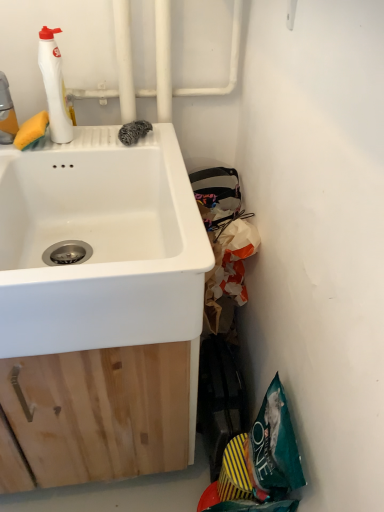
In order to face white matte bottle at upper left, which is the first cleaning product in right-to-left order, should I rotate leftwards or rightwards?

Turn left by 17.891 degrees to look at white matte bottle at upper left, which is the first cleaning product in right-to-left order.

Describe the element at coordinates (260, 462) in the screenshot. I see `teal fabric bag at lower right` at that location.

Find the location of `white ceramic sink at upper left`. white ceramic sink at upper left is located at coordinates (100, 244).

The image size is (384, 512). Find the location of `white matte bottle at upper left, which is the first cleaning product in right-to-left order`. white matte bottle at upper left, which is the first cleaning product in right-to-left order is located at coordinates (54, 86).

Based on the photo, considering the sizes of objects white ceramic sink at upper left and teal fabric bag at lower right in the image provided, who is smaller, white ceramic sink at upper left or teal fabric bag at lower right?

Smaller between the two is teal fabric bag at lower right.

Could teal fabric bag at lower right be considered to be inside white ceramic sink at upper left?

Definitely not — teal fabric bag at lower right is not inside white ceramic sink at upper left.

From the image's perspective, would you say white ceramic sink at upper left is shown under teal fabric bag at lower right?

No, from the image's perspective, white ceramic sink at upper left is not beneath teal fabric bag at lower right.

Does translucent white bottle at upper left, which is the 1th cleaning product from left to right, have a lesser width compared to teal fabric bag at lower right?

No, translucent white bottle at upper left, which is the 1th cleaning product from left to right, is not thinner than teal fabric bag at lower right.

Is translucent white bottle at upper left, which is the 1th cleaning product from left to right, oriented away from teal fabric bag at lower right?

No, translucent white bottle at upper left, which is the 1th cleaning product from left to right,'s orientation is not away from teal fabric bag at lower right.

Based on the photo, does translucent white bottle at upper left, which is the 1th cleaning product from left to right, lie in front of teal fabric bag at lower right?

Yes, translucent white bottle at upper left, which is the 1th cleaning product from left to right, is closer to the camera.

Who is shorter, teal fabric bag at lower right or translucent white bottle at upper left, which is the 1th cleaning product from left to right?

With less height is translucent white bottle at upper left, which is the 1th cleaning product from left to right.

Considering the relative positions of teal fabric bag at lower right and translucent white bottle at upper left, which ranks as the 2th cleaning product in right-to-left order, in the image provided, is teal fabric bag at lower right to the right of translucent white bottle at upper left, which ranks as the 2th cleaning product in right-to-left order, from the viewer's perspective?

Yes, teal fabric bag at lower right is to the right of translucent white bottle at upper left, which ranks as the 2th cleaning product in right-to-left order.

From a real-world perspective, is teal fabric bag at lower right physically located above or below translucent white bottle at upper left, which is the 1th cleaning product from left to right?

From a real-world perspective, teal fabric bag at lower right is physically below translucent white bottle at upper left, which is the 1th cleaning product from left to right.

From the image's perspective, is translucent white bottle at upper left, which is the 1th cleaning product from left to right, beneath white ceramic sink at upper left?

Actually, translucent white bottle at upper left, which is the 1th cleaning product from left to right, appears above white ceramic sink at upper left in the image.

In terms of width, does translucent white bottle at upper left, which is the 1th cleaning product from left to right, look wider or thinner when compared to white ceramic sink at upper left?

Considering their sizes, translucent white bottle at upper left, which is the 1th cleaning product from left to right, looks slimmer than white ceramic sink at upper left.

Which is nearer, (x=5, y=100) or (x=21, y=234)?

Point (x=5, y=100) appears to be closer to the viewer than point (x=21, y=234).

Which of these two, teal fabric bag at lower right or white ceramic sink at upper left, is smaller?

teal fabric bag at lower right.

At what (x,y) coordinates should I click in order to perform the action: click on garbage that appears behind the white ceramic sink at upper left. Please return your answer as a coordinate pair (x, y). This screenshot has width=384, height=512. Looking at the image, I should click on (260, 462).

Considering the positions of points (279, 400) and (139, 179), is point (279, 400) closer to camera compared to point (139, 179)?

Yes, it is in front of point (139, 179).

From the image's perspective, is teal fabric bag at lower right above white matte bottle at upper left, which is the first cleaning product in right-to-left order?

Incorrect, from the image's perspective, teal fabric bag at lower right is lower than white matte bottle at upper left, which is the first cleaning product in right-to-left order.

Is teal fabric bag at lower right at the left side of white matte bottle at upper left, which is the first cleaning product in right-to-left order?

Incorrect, teal fabric bag at lower right is not on the left side of white matte bottle at upper left, which is the first cleaning product in right-to-left order.

Is teal fabric bag at lower right thinner than white matte bottle at upper left, which ranks as the second cleaning product in left-to-right order?

In fact, teal fabric bag at lower right might be wider than white matte bottle at upper left, which ranks as the second cleaning product in left-to-right order.

Is teal fabric bag at lower right oriented away from white matte bottle at upper left, which is the first cleaning product in right-to-left order?

No, teal fabric bag at lower right's orientation is not away from white matte bottle at upper left, which is the first cleaning product in right-to-left order.

From their relative heights in the image, would you say white ceramic sink at upper left is taller or shorter than white matte bottle at upper left, which is the first cleaning product in right-to-left order?

Considering their sizes, white ceramic sink at upper left has more height than white matte bottle at upper left, which is the first cleaning product in right-to-left order.

From the picture: Does white ceramic sink at upper left touch white matte bottle at upper left, which is the first cleaning product in right-to-left order?

white ceramic sink at upper left is not next to white matte bottle at upper left, which is the first cleaning product in right-to-left order, and they're not touching.

Is white ceramic sink at upper left facing towards white matte bottle at upper left, which is the first cleaning product in right-to-left order?

No, white ceramic sink at upper left is not aimed at white matte bottle at upper left, which is the first cleaning product in right-to-left order.

Does white ceramic sink at upper left come in front of white matte bottle at upper left, which ranks as the second cleaning product in left-to-right order?

Yes, the depth of white ceramic sink at upper left is less than that of white matte bottle at upper left, which ranks as the second cleaning product in left-to-right order.

This screenshot has height=512, width=384. I want to click on sink in front of the teal fabric bag at lower right, so click(100, 244).

Locate an element on the screen. garbage on the right of the translucent white bottle at upper left, which is the 1th cleaning product from left to right is located at coordinates (260, 462).

When comparing their distances from white matte bottle at upper left, which ranks as the second cleaning product in left-to-right order, does teal fabric bag at lower right or translucent white bottle at upper left, which is the 1th cleaning product from left to right, seem further?

teal fabric bag at lower right is positioned further to the anchor white matte bottle at upper left, which ranks as the second cleaning product in left-to-right order.

Looking at the image, which one is located closer to translucent white bottle at upper left, which ranks as the 2th cleaning product in right-to-left order, teal fabric bag at lower right or white matte bottle at upper left, which is the first cleaning product in right-to-left order?

Based on the image, white matte bottle at upper left, which is the first cleaning product in right-to-left order, appears to be nearer to translucent white bottle at upper left, which ranks as the 2th cleaning product in right-to-left order.

Looking at this image, estimate the real-world distances between objects in this image. Which object is further from translucent white bottle at upper left, which ranks as the 2th cleaning product in right-to-left order, white matte bottle at upper left, which is the first cleaning product in right-to-left order, or white ceramic sink at upper left?

The object further to translucent white bottle at upper left, which ranks as the 2th cleaning product in right-to-left order, is white ceramic sink at upper left.

Which object lies further to the anchor point white matte bottle at upper left, which is the first cleaning product in right-to-left order, translucent white bottle at upper left, which is the 1th cleaning product from left to right, or teal fabric bag at lower right?

teal fabric bag at lower right is positioned further to the anchor white matte bottle at upper left, which is the first cleaning product in right-to-left order.

Estimate the real-world distances between objects in this image. Which object is closer to translucent white bottle at upper left, which ranks as the 2th cleaning product in right-to-left order, white matte bottle at upper left, which is the first cleaning product in right-to-left order, or teal fabric bag at lower right?

The object closer to translucent white bottle at upper left, which ranks as the 2th cleaning product in right-to-left order, is white matte bottle at upper left, which is the first cleaning product in right-to-left order.

Considering their positions, is white ceramic sink at upper left positioned further to white matte bottle at upper left, which ranks as the second cleaning product in left-to-right order, than teal fabric bag at lower right?

teal fabric bag at lower right lies further to white matte bottle at upper left, which ranks as the second cleaning product in left-to-right order, than the other object.

Based on their spatial positions, is teal fabric bag at lower right or translucent white bottle at upper left, which is the 1th cleaning product from left to right, further from white ceramic sink at upper left?

Among the two, teal fabric bag at lower right is located further to white ceramic sink at upper left.

Based on their spatial positions, is translucent white bottle at upper left, which ranks as the 2th cleaning product in right-to-left order, or white matte bottle at upper left, which ranks as the second cleaning product in left-to-right order, further from white ceramic sink at upper left?

translucent white bottle at upper left, which ranks as the 2th cleaning product in right-to-left order, lies further to white ceramic sink at upper left than the other object.

This screenshot has width=384, height=512. I want to click on sink between white matte bottle at upper left, which is the first cleaning product in right-to-left order, and teal fabric bag at lower right vertically, so click(100, 244).

Image resolution: width=384 pixels, height=512 pixels. In order to click on cleaning product between white matte bottle at upper left, which is the first cleaning product in right-to-left order, and white ceramic sink at upper left from top to bottom in this screenshot , I will do `click(7, 113)`.

You are a GUI agent. You are given a task and a screenshot of the screen. Output one action in this format:
    pyautogui.click(x=<x>, y=<y>)
    Task: Click on the cleaning product between white matte bottle at upper left, which ranks as the second cleaning product in left-to-right order, and teal fabric bag at lower right from top to bottom
    This screenshot has width=384, height=512.
    Given the screenshot: What is the action you would take?
    pyautogui.click(x=7, y=113)

Identify the location of sink between translucent white bottle at upper left, which is the 1th cleaning product from left to right, and teal fabric bag at lower right in the up-down direction. This screenshot has width=384, height=512. (100, 244).